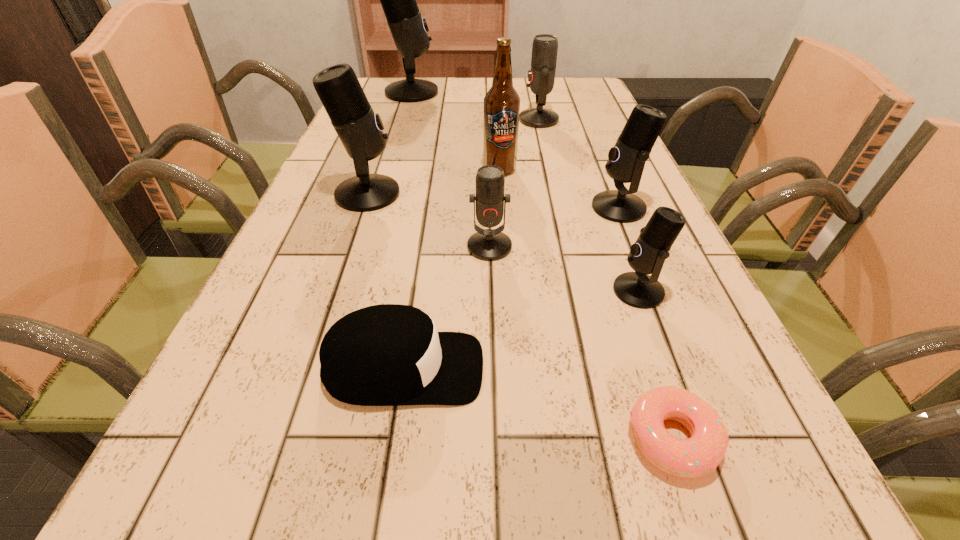
I want to click on the fourth nearest object, so click(486, 244).

Find the location of `black cap`. black cap is located at coordinates (389, 354).

I want to click on cap, so click(x=389, y=354).

Where is `doughnut`? The image size is (960, 540). doughnut is located at coordinates (702, 453).

Where is `pink doughnut`? This screenshot has height=540, width=960. pink doughnut is located at coordinates (702, 453).

Find the location of a particular element. The height and width of the screenshot is (540, 960). free region located 0.320m on the stand of the biggest black microphone is located at coordinates (538, 92).

Locate an element on the screen. free region located on the label of the beer bottle is located at coordinates (507, 278).

This screenshot has height=540, width=960. I want to click on free space located 0.240m on the stand of the second tallest microphone, so click(x=508, y=194).

You are a GUI agent. You are given a task and a screenshot of the screen. Output one action in this format:
    pyautogui.click(x=<x>, y=<y>)
    Task: Click on the free spot located 0.320m on the stand of the third biggest black microphone
    The width and height of the screenshot is (960, 540).
    Given the screenshot: What is the action you would take?
    pyautogui.click(x=442, y=207)

You are a GUI agent. You are given a task and a screenshot of the screen. Output one action in this format:
    pyautogui.click(x=<x>, y=<y>)
    Task: Click on the free location located on the stand of the third biggest black microphone
    This screenshot has width=960, height=540.
    Given the screenshot: What is the action you would take?
    pyautogui.click(x=512, y=207)